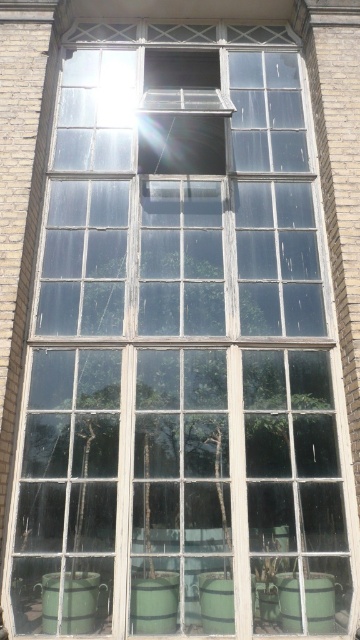
Does green wooden barrel at lower right have a greater width compared to green wooden barrel at lower center?

Indeed, green wooden barrel at lower right has a greater width compared to green wooden barrel at lower center.

Measure the distance between green wooden barrel at lower right and green wooden barrel at lower center.

A distance of 15.43 inches exists between green wooden barrel at lower right and green wooden barrel at lower center.

Locate an element on the screen. green wooden barrel at lower right is located at coordinates (320, 602).

Is green wooden barrel at lower left to the right of green wooden barrel at lower right from the viewer's perspective?

Incorrect, green wooden barrel at lower left is not on the right side of green wooden barrel at lower right.

Is green wooden barrel at lower left bigger than green wooden barrel at lower right?

Yes.

Between point (65, 596) and point (275, 582), which one is positioned in front?

Point (65, 596) is in front.

You are a GUI agent. You are given a task and a screenshot of the screen. Output one action in this format:
    pyautogui.click(x=<x>, y=<y>)
    Task: Click on the green wooden barrel at lower left
    The height and width of the screenshot is (640, 360).
    Given the screenshot: What is the action you would take?
    pyautogui.click(x=69, y=602)

Is green wooden barrel at lower left behind green wooden barrel at lower center?

No.

Between green wooden barrel at lower left and green wooden barrel at lower center, which one is positioned higher?

green wooden barrel at lower left is above.

Is point (50, 586) closer to camera compared to point (222, 612)?

No, it is behind (222, 612).

Find the location of `green wooden barrel at lower left`. green wooden barrel at lower left is located at coordinates (69, 602).